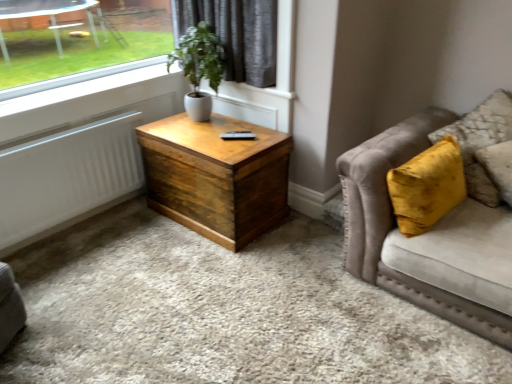
The width and height of the screenshot is (512, 384). I want to click on vacant region above white matte radiator at left (from a real-world perspective), so click(x=60, y=137).